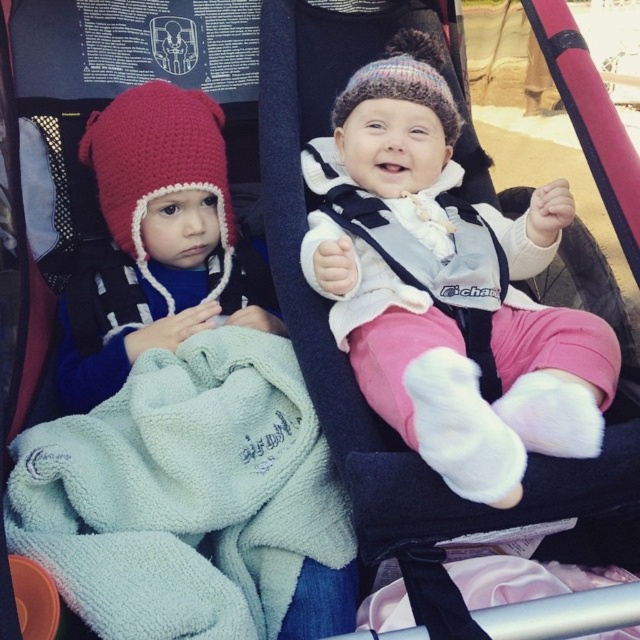
Does matte red knit hat at left have a smaller size compared to crochet knit hat at left?

Actually, matte red knit hat at left might be larger than crochet knit hat at left.

Which is in front, point (152, 273) or point (176, 145)?

Point (176, 145)

Who is more distant from viewer, (120, 232) or (132, 237)?

The point (120, 232) is more distant.

What are the coordinates of `matte red knit hat at left` in the screenshot? It's located at (156, 241).

Can you confirm if knitted woolen hat at center is positioned to the left of crochet knit hat at left?

In fact, knitted woolen hat at center is to the right of crochet knit hat at left.

Between point (465, 342) and point (148, 125), which one is positioned behind?

Positioned behind is point (148, 125).

I want to click on knitted woolen hat at center, so click(x=451, y=291).

Is knitted woolen hat at center closer to the viewer compared to matte red knit hat at left?

Yes, knitted woolen hat at center is closer to the viewer.

What do you see at coordinates (451, 291) in the screenshot?
I see `knitted woolen hat at center` at bounding box center [451, 291].

Locate an element on the screen. This screenshot has height=640, width=640. knitted woolen hat at center is located at coordinates (451, 291).